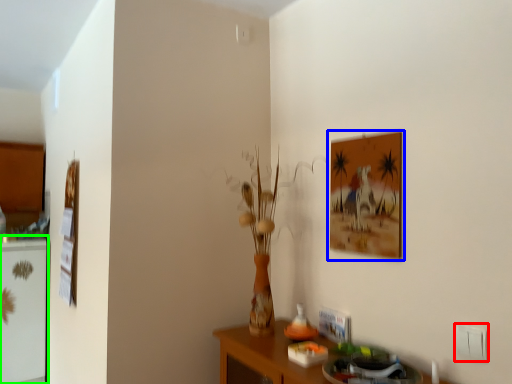
Question: Considering the real-world distances, which object is farthest from electric outlet (highlighted by a red box)? picture frame (highlighted by a blue box) or fridge (highlighted by a green box)?

Choices:
 (A) picture frame
 (B) fridge

Answer: (B)